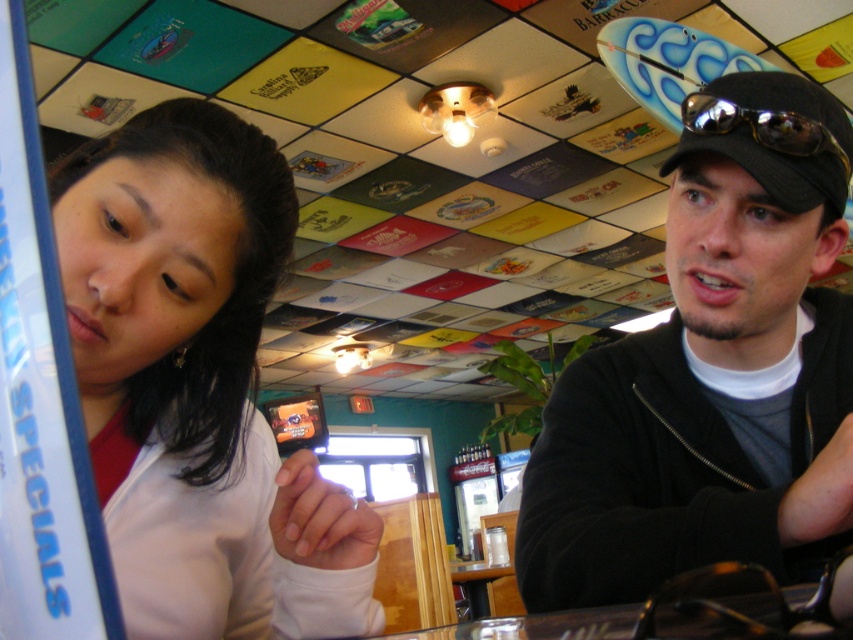
Can you confirm if black matte jacket at upper right is positioned below sunglassesmetallicgoggles at right?

Correct, black matte jacket at upper right is located below sunglassesmetallicgoggles at right.

Can you confirm if black matte jacket at upper right is positioned to the right of sunglassesmetallicgoggles at right?

Correct, you'll find black matte jacket at upper right to the right of sunglassesmetallicgoggles at right.

Image resolution: width=853 pixels, height=640 pixels. Describe the element at coordinates (712, 374) in the screenshot. I see `black matte jacket at upper right` at that location.

Where is `black matte jacket at upper right`? black matte jacket at upper right is located at coordinates (712, 374).

Which is behind, point (136, 404) or point (799, 134)?

The point (136, 404) is behind.

Is the position of matte white shirt at left less distant than that of sunglassesmetallicgoggles at right?

That is True.

Where is `matte white shirt at left`? The width and height of the screenshot is (853, 640). matte white shirt at left is located at coordinates (198, 385).

Who is positioned more to the left, black matte jacket at upper right or matte white shirt at left?

matte white shirt at left

Does black matte jacket at upper right appear on the left side of matte white shirt at left?

Incorrect, black matte jacket at upper right is not on the left side of matte white shirt at left.

The width and height of the screenshot is (853, 640). Describe the element at coordinates (712, 374) in the screenshot. I see `black matte jacket at upper right` at that location.

Find the location of a particular element. This screenshot has height=640, width=853. black matte jacket at upper right is located at coordinates (712, 374).